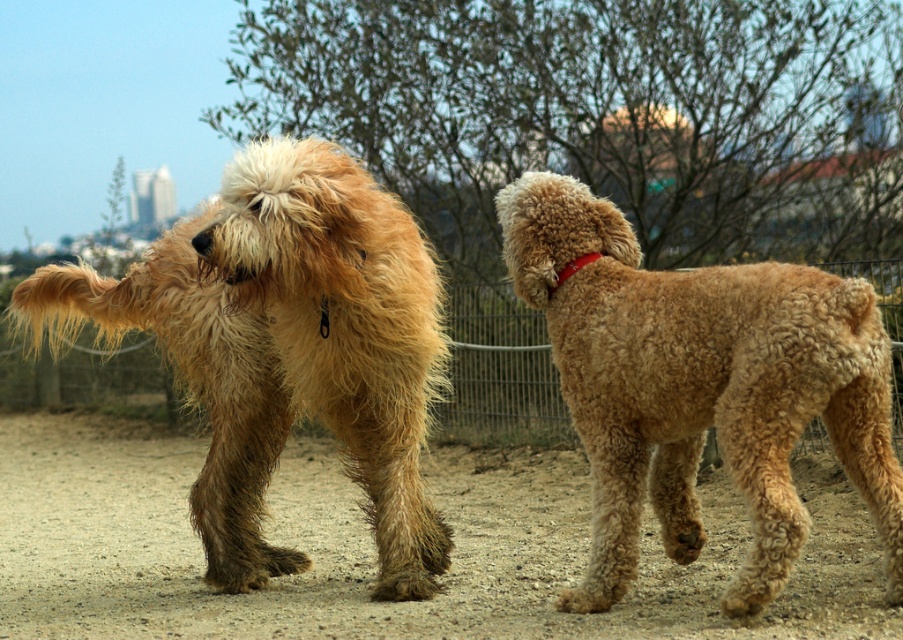
Question: Among these objects, which one is nearest to the camera?

Choices:
 (A) golden fur dog at left
 (B) metallic wire fence at center
 (C) golden curly fur dog at center
 (D) red leather collar at upper right

Answer: (C)

Question: Is golden fur dog at left wider than red leather collar at upper right?

Choices:
 (A) no
 (B) yes

Answer: (B)

Question: Can you confirm if brown sandy ground at center is smaller than golden curly fur dog at center?

Choices:
 (A) yes
 (B) no

Answer: (B)

Question: Can you confirm if golden fur dog at left is positioned to the left of golden curly fur dog at center?

Choices:
 (A) no
 (B) yes

Answer: (B)

Question: Which is farther from the golden curly fur dog at center?

Choices:
 (A) brown sandy ground at center
 (B) red leather collar at upper right
 (C) metallic wire fence at center

Answer: (C)

Question: Which of the following is the farthest from the observer?

Choices:
 (A) (165, 317)
 (B) (887, 296)
 (C) (556, 273)
 (D) (587, 420)

Answer: (B)